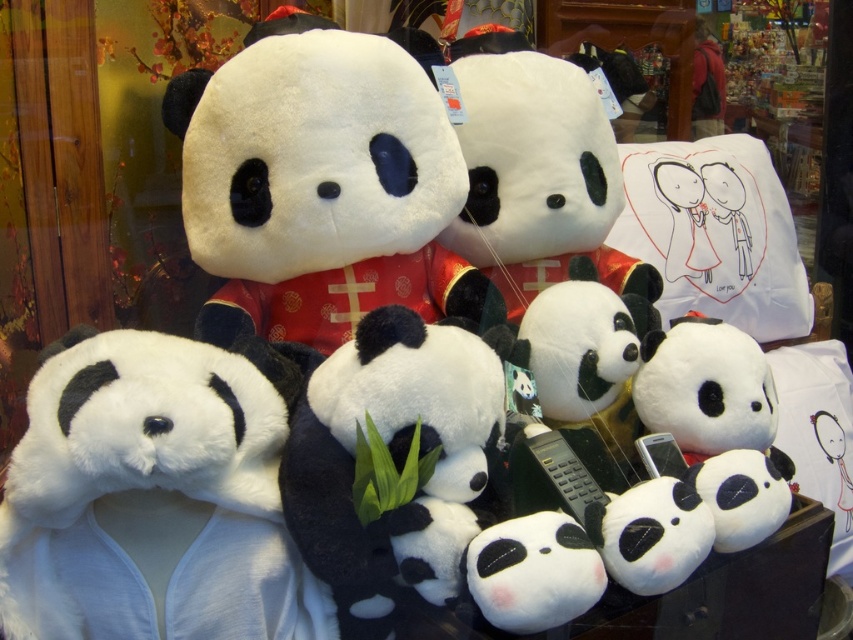
Question: Which of the following is the farthest from the observer?

Choices:
 (A) fluffy white panda at left
 (B) soft plush panda at center

Answer: (B)

Question: Is fluffy white panda at left below soft plush panda at center?

Choices:
 (A) no
 (B) yes

Answer: (B)

Question: Is fluffy white panda at left behind soft plush panda at center?

Choices:
 (A) yes
 (B) no

Answer: (B)

Question: Which of the following is the closest to the observer?

Choices:
 (A) (445, 138)
 (B) (267, 368)

Answer: (B)

Question: Is fluffy white panda at left in front of soft plush panda at center?

Choices:
 (A) no
 (B) yes

Answer: (B)

Question: Which object appears closest to the camera in this image?

Choices:
 (A) fluffy white panda at left
 (B) soft plush panda at center

Answer: (A)